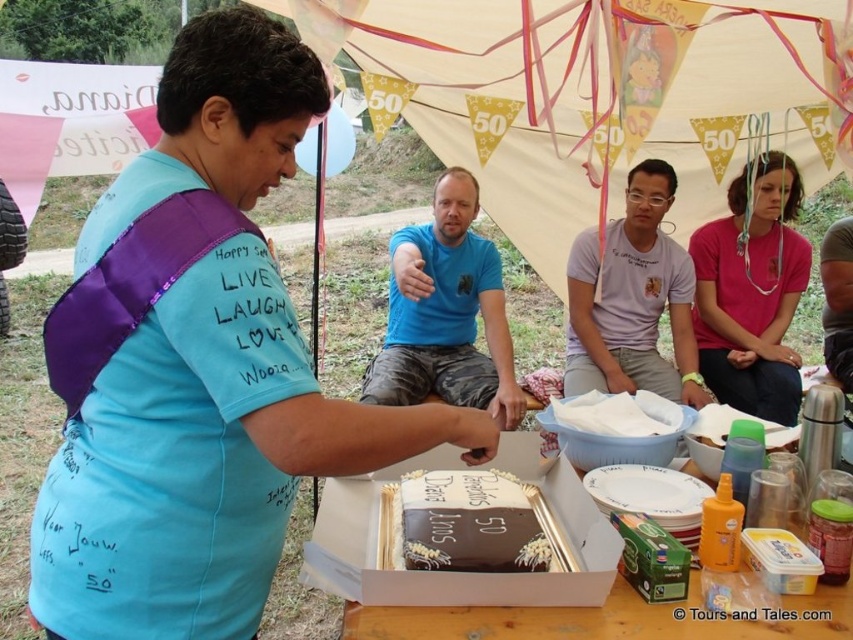
Which is below, pink fabric shirt at upper right or chocolatesmoothcake at center?

chocolatesmoothcake at center

Does pink fabric shirt at upper right have a greater height compared to chocolatesmoothcake at center?

Yes.

This screenshot has width=853, height=640. What are the coordinates of `pink fabric shirt at upper right` in the screenshot? It's located at (752, 291).

Can you confirm if white fabric tent at center is positioned to the left of chocolate cake at center?

Incorrect, white fabric tent at center is not on the left side of chocolate cake at center.

Can you confirm if white fabric tent at center is thinner than chocolate cake at center?

In fact, white fabric tent at center might be wider than chocolate cake at center.

Does point (367, 54) come farther from viewer compared to point (415, 577)?

Yes, it is behind point (415, 577).

This screenshot has width=853, height=640. Find the location of `white fabric tent at center`. white fabric tent at center is located at coordinates click(601, 96).

Does white fabric tent at center appear under pink fabric shirt at upper right?

→ Actually, white fabric tent at center is above pink fabric shirt at upper right.

Does white fabric tent at center appear over pink fabric shirt at upper right?

Indeed, white fabric tent at center is positioned over pink fabric shirt at upper right.

Between point (654, 40) and point (706, 372), which one is positioned in front?

Point (654, 40) is in front.

Image resolution: width=853 pixels, height=640 pixels. Identify the location of white fabric tent at center. (601, 96).